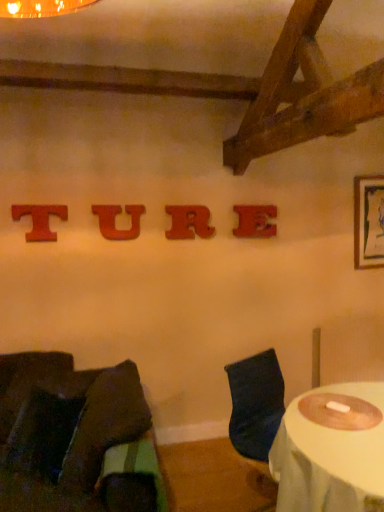
Question: Which direction should I rotate to look at wooden letter u at center, which is the 2th alphabet from left to right?

Choices:
 (A) left
 (B) right

Answer: (A)

Question: Is red wood letter t at upper center, which is counted as the fourth alphabet, starting from the right, looking in the opposite direction of white fabric-covered table at lower right?

Choices:
 (A) yes
 (B) no

Answer: (B)

Question: Does red wood letter t at upper center, which is the first alphabet from left to right, have a larger size compared to white fabric-covered table at lower right?

Choices:
 (A) no
 (B) yes

Answer: (A)

Question: From the image's perspective, is red wood letter t at upper center, which is counted as the fourth alphabet, starting from the right, located above white fabric-covered table at lower right?

Choices:
 (A) yes
 (B) no

Answer: (A)

Question: Is red wood letter t at upper center, which is the first alphabet from left to right, facing towards white fabric-covered table at lower right?

Choices:
 (A) yes
 (B) no

Answer: (B)

Question: Is white fabric-covered table at lower right surrounded by red wood letter t at upper center, which is counted as the fourth alphabet, starting from the right?

Choices:
 (A) yes
 (B) no

Answer: (B)

Question: Is red wood letter t at upper center, which is counted as the fourth alphabet, starting from the right, positioned in front of white fabric-covered table at lower right?

Choices:
 (A) no
 (B) yes

Answer: (A)

Question: Considering the relative sizes of wooden letter e at center, which is the 4th alphabet in left-to-right order, and red wood letter t at upper center, which is the first alphabet from left to right, in the image provided, is wooden letter e at center, which is the 4th alphabet in left-to-right order, taller than red wood letter t at upper center, which is the first alphabet from left to right,?

Choices:
 (A) no
 (B) yes

Answer: (B)

Question: From a real-world perspective, is wooden letter e at center, the first alphabet viewed from the right, positioned over red wood letter t at upper center, which is the first alphabet from left to right, based on gravity?

Choices:
 (A) yes
 (B) no

Answer: (B)

Question: Is wooden letter e at center, the first alphabet viewed from the right, oriented away from red wood letter t at upper center, which is the first alphabet from left to right?

Choices:
 (A) yes
 (B) no

Answer: (B)

Question: Is wooden letter e at center, which is the 4th alphabet in left-to-right order, positioned beyond the bounds of red wood letter t at upper center, which is the first alphabet from left to right?

Choices:
 (A) yes
 (B) no

Answer: (A)

Question: Is wooden letter e at center, the first alphabet viewed from the right, to the left of red wood letter t at upper center, which is counted as the fourth alphabet, starting from the right, from the viewer's perspective?

Choices:
 (A) yes
 (B) no

Answer: (B)

Question: Considering the relative positions of wooden letter e at center, which is the 4th alphabet in left-to-right order, and red wood letter t at upper center, which is counted as the fourth alphabet, starting from the right, in the image provided, is wooden letter e at center, which is the 4th alphabet in left-to-right order, to the right of red wood letter t at upper center, which is counted as the fourth alphabet, starting from the right, from the viewer's perspective?

Choices:
 (A) no
 (B) yes

Answer: (B)

Question: Considering the relative sizes of red wood letter t at upper center, which is the first alphabet from left to right, and wooden letter e at center, the first alphabet viewed from the right, in the image provided, is red wood letter t at upper center, which is the first alphabet from left to right, bigger than wooden letter e at center, the first alphabet viewed from the right,?

Choices:
 (A) yes
 (B) no

Answer: (B)